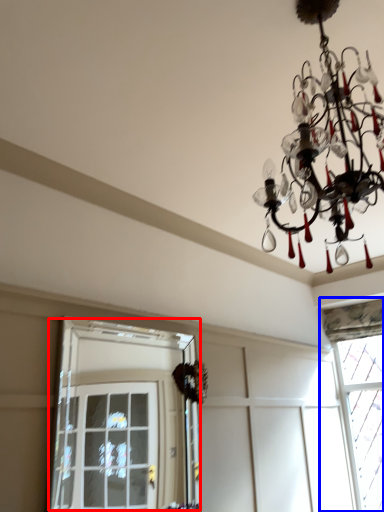
Question: Which point is closer to the camera, window (highlighted by a red box) or window (highlighted by a blue box)?

Choices:
 (A) window
 (B) window

Answer: (A)